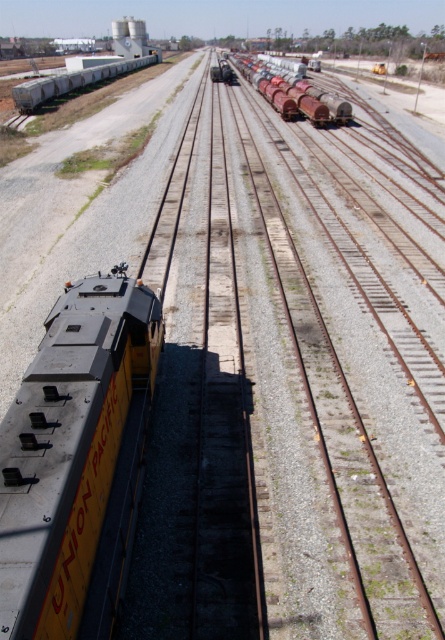
Question: Among these objects, which one is farthest from the camera?

Choices:
 (A) white matte train car at upper left
 (B) reddish-brown tank cars at upper right

Answer: (A)

Question: Is the position of yellow matte train at center less distant than that of white matte train car at upper left?

Choices:
 (A) no
 (B) yes

Answer: (B)

Question: Which point appears closest to the camera in this image?

Choices:
 (A) (284, 115)
 (B) (105, 74)
 (C) (52, 312)

Answer: (C)

Question: Estimate the real-world distances between objects in this image. Which object is farther from the white matte train car at upper left?

Choices:
 (A) reddish-brown tank cars at upper right
 (B) yellow matte train at center

Answer: (B)

Question: Does reddish-brown tank cars at upper right appear on the left side of white matte train car at upper left?

Choices:
 (A) yes
 (B) no

Answer: (B)

Question: Does yellow matte train at center have a lesser width compared to white matte train car at upper left?

Choices:
 (A) no
 (B) yes

Answer: (B)